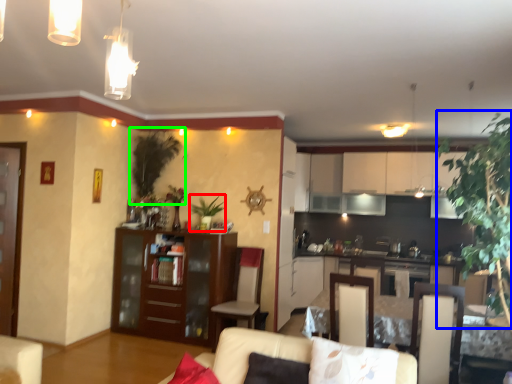
Question: Which object is positioned farthest from plant (highlighted by a red box)? Select from plant (highlighted by a blue box) and plant (highlighted by a green box).

Choices:
 (A) plant
 (B) plant

Answer: (A)